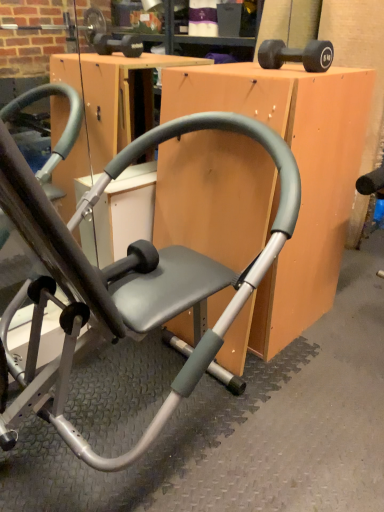
Question: From the image's perspective, is matte gray chair at center above or below black rubber dumbbell at upper right?

Choices:
 (A) below
 (B) above

Answer: (A)

Question: Would you say matte gray chair at center is inside or outside black rubber dumbbell at upper right?

Choices:
 (A) outside
 (B) inside

Answer: (A)

Question: Which object is positioned closest to the black rubber dumbbell at upper right?

Choices:
 (A) matte gray chair at center
 (B) matte gray chair at center

Answer: (A)

Question: Estimate the real-world distances between objects in this image. Which object is farther from the matte gray chair at center?

Choices:
 (A) black rubber dumbbell at upper right
 (B) matte gray chair at center

Answer: (A)